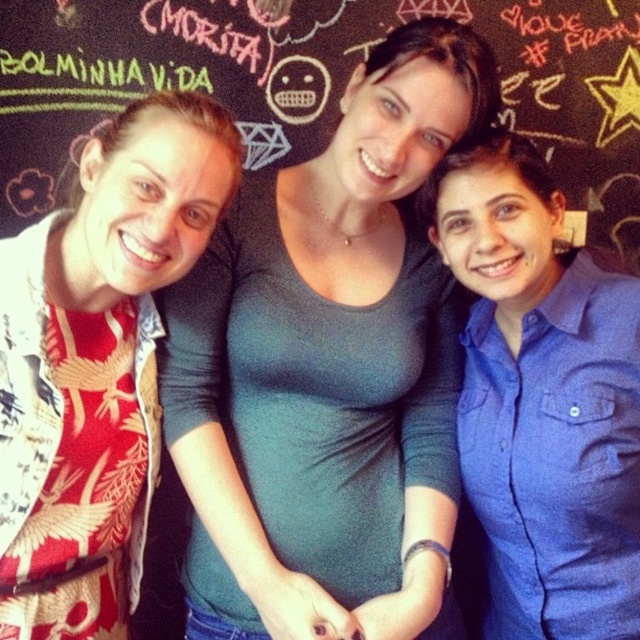
You are standing in front of the chalkboard wall and want to take a photo of the green matte shirt at center and the printed silk blouse at left. Which one is closer to you?

The green matte shirt at center is closer to you because it is further to the viewer than the printed silk blouse at left.

You are a photographer setting up for a group photo. You notice the printed silk blouse at left and the black chalkboard at center. Which object is positioned lower in the image?

The printed silk blouse at left is below the black chalkboard at center, so it is positioned lower in the image.

You are trying to hang a small picture frame on the wall behind the printed silk blouse at left and the black chalkboard at center. Based on their sizes, which object would allow the frame to be placed farther away from the wall without blocking the other object?

The black chalkboard at center occupies more space than the printed silk blouse at left, so placing the frame farther away from the wall behind the black chalkboard at center would allow it to not block the printed silk blouse at left.